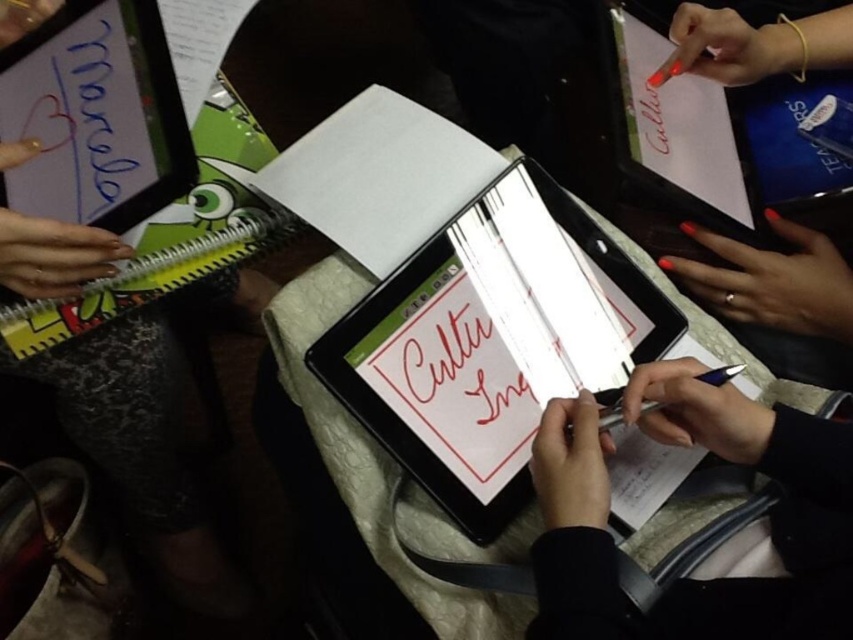
Question: Considering the real-world distances, which object is farthest from the white paper at center?

Choices:
 (A) smooth black tablet at center
 (B) matte black tablet at left
 (C) metallic silver pen at center

Answer: (B)

Question: Considering the relative positions of smooth black tablet at center and matte black marker at upper left in the image provided, where is smooth black tablet at center located with respect to matte black marker at upper left?

Choices:
 (A) above
 (B) below

Answer: (B)

Question: Among these objects, which one is farthest from the camera?

Choices:
 (A) smooth black tablet at center
 (B) matte black marker at upper left
 (C) matte black tablet at left

Answer: (B)

Question: Does white paper at center appear under matte black marker at upper left?

Choices:
 (A) yes
 (B) no

Answer: (A)

Question: Does white paper at center appear on the right side of metallic silver pen at center?

Choices:
 (A) no
 (B) yes

Answer: (A)

Question: Estimate the real-world distances between objects in this image. Which object is closer to the matte black marker at upper left?

Choices:
 (A) smooth black tablet at center
 (B) metallic silver pen at center

Answer: (B)